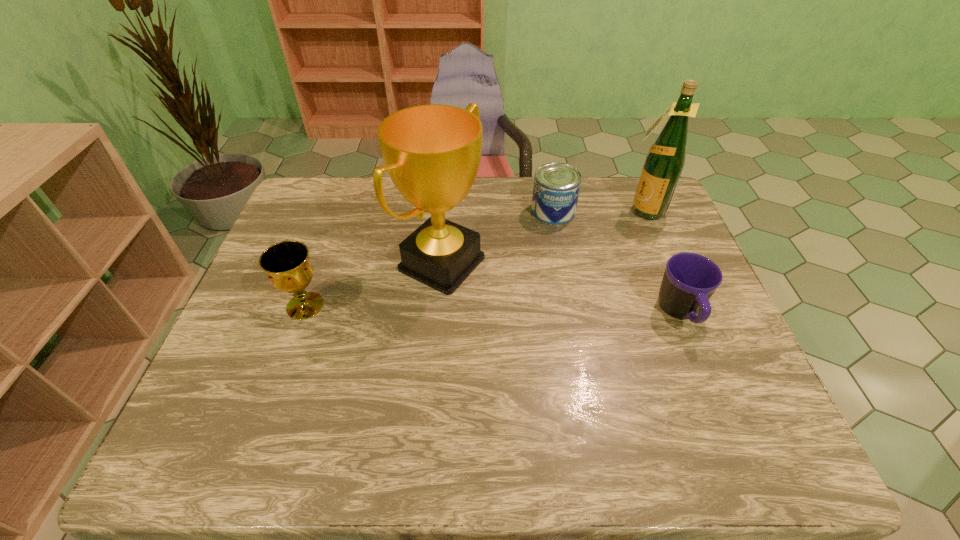
Select which object appears as the third closest to the award. Please provide its 2D coordinates. Your answer should be formatted as a tuple, i.e. [(x, y)], where the tuple contains the x and y coordinates of a point satisfying the conditions above.

[(689, 281)]

The image size is (960, 540). Find the location of `free space in the image that satisfies the following two spatial constraints: 1. on the back side of the can; 2. on the left side of the fourth object from right to left`. free space in the image that satisfies the following two spatial constraints: 1. on the back side of the can; 2. on the left side of the fourth object from right to left is located at coordinates (446, 212).